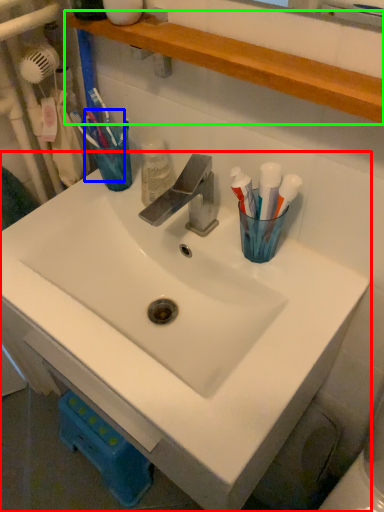
Question: Estimate the real-world distances between objects in this image. Which object is closer to sink (highlighted by a red box), toothbrush (highlighted by a blue box) or shelve (highlighted by a green box)?

Choices:
 (A) toothbrush
 (B) shelve

Answer: (A)